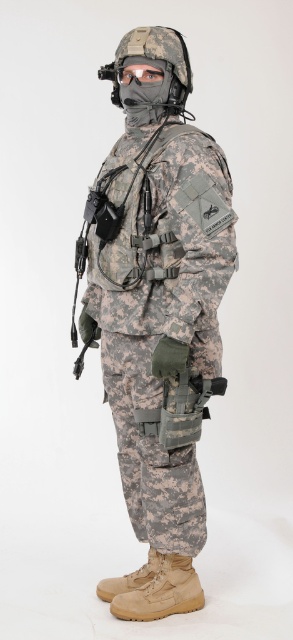
You are a tailor trying to determine the correct size for the camouflage fabric uniform at center and the matte black goggles at center. Which object has a greater width?

The camouflage fabric uniform at center has a greater width than the matte black goggles at center according to the description.

You are a military equipment inspector examining the image. You need to determine the spatial arrangement of the camouflage fabric uniform at center and the matte black goggles at center. Based on the scene description, which object is located to the left?

The matte black goggles at center are located to the left of the camouflage fabric uniform at center because the camouflage fabric uniform at center is positioned on the right side of the matte black goggles at center.